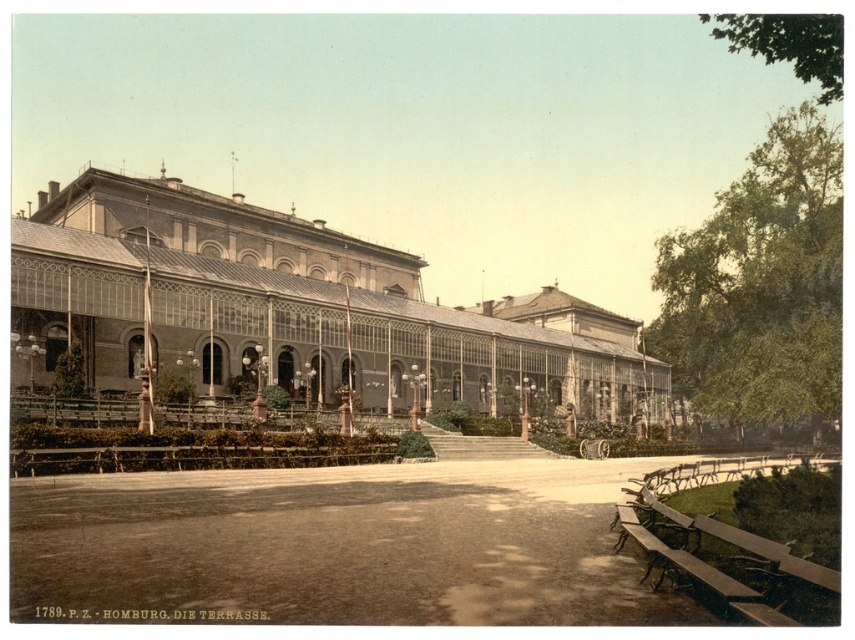
Question: Is matte glass palace at center further to the viewer compared to wooden park bench at lower right?

Choices:
 (A) yes
 (B) no

Answer: (A)

Question: Which object is farther from the camera taking this photo?

Choices:
 (A) wooden park bench at lower right
 (B) matte glass palace at center

Answer: (B)

Question: Which object is closer to the camera taking this photo?

Choices:
 (A) matte glass palace at center
 (B) wooden park bench at lower right

Answer: (B)

Question: Which of the following is the closest to the observer?

Choices:
 (A) wooden park bench at lower right
 (B) matte glass palace at center

Answer: (A)

Question: Can you confirm if matte glass palace at center is positioned to the left of wooden park bench at lower right?

Choices:
 (A) yes
 (B) no

Answer: (A)

Question: Is matte glass palace at center smaller than wooden park bench at lower right?

Choices:
 (A) yes
 (B) no

Answer: (B)